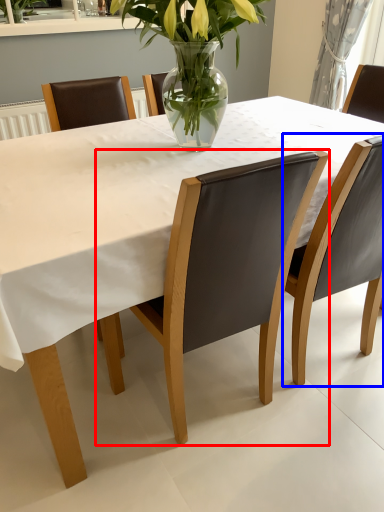
Question: Which point is further to the camera, chair (highlighted by a red box) or chair (highlighted by a blue box)?

Choices:
 (A) chair
 (B) chair

Answer: (B)